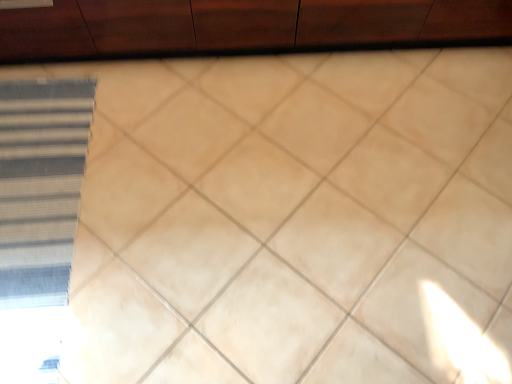
Find the location of a particular element. free region under textured beige curtain at left (from a real-world perspective) is located at coordinates (37, 222).